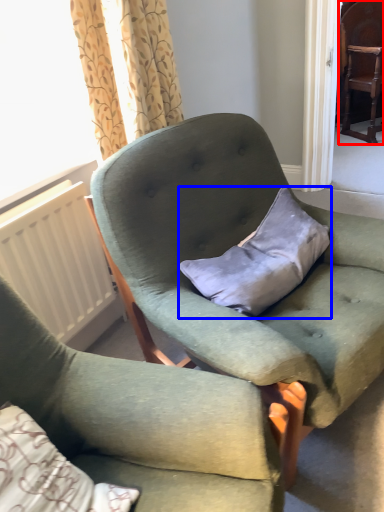
Question: Which object is closer to the camera taking this photo, chair (highlighted by a red box) or pillow (highlighted by a blue box)?

Choices:
 (A) chair
 (B) pillow

Answer: (B)